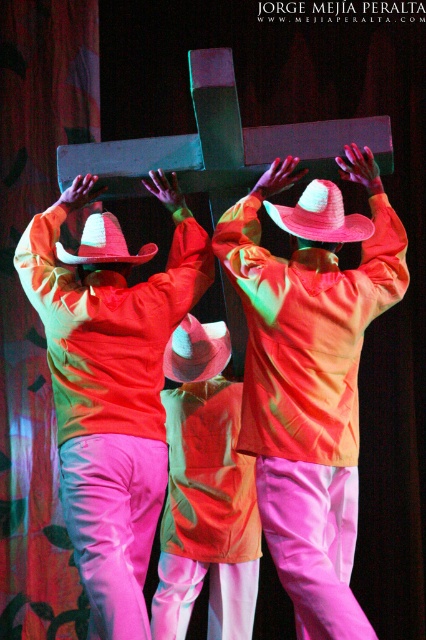
Can you confirm if pink satin hat at upper center is bigger than pink straw cowboy hat at center?

Indeed, pink satin hat at upper center has a larger size compared to pink straw cowboy hat at center.

At what (x,y) coordinates should I click in order to perform the action: click on pink satin hat at upper center. Please return your answer as a coordinate pair (x, y). This screenshot has height=640, width=426. Looking at the image, I should click on (310, 378).

Is pink felt cowboy hat at center in front of white felt cowboy hat at center?

No, pink felt cowboy hat at center is further to the viewer.

Is point (207, 376) closer to camera compared to point (78, 253)?

No, (207, 376) is further to viewer.

Identify the location of pink felt cowboy hat at center. pos(196,349).

Who is more forward, (117, 273) or (362, 230)?

Point (362, 230) is in front.

Can you confirm if pink satin pants at center is bigger than pink straw cowboy hat at center?

Yes, pink satin pants at center is bigger than pink straw cowboy hat at center.

Locate an element on the screen. This screenshot has height=640, width=426. pink satin pants at center is located at coordinates (112, 387).